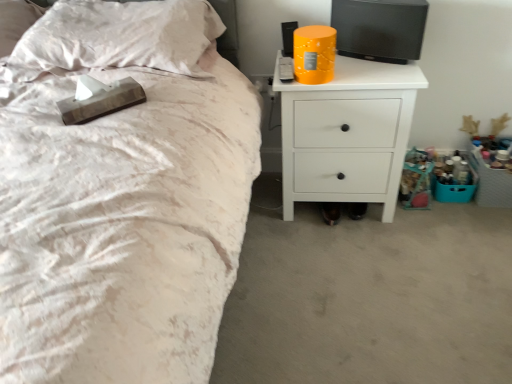
Measure the distance between point (345, 74) and camera.

The depth of point (345, 74) is 1.62 meters.

Find the location of a particular element. The width and height of the screenshot is (512, 384). white matte nightstand at upper right is located at coordinates (347, 134).

Describe the element at coordinates (347, 134) in the screenshot. This screenshot has height=384, width=512. I see `white matte nightstand at upper right` at that location.

Looking at this image, what is the approximate width of white satin pillow at upper left?

17.87 inches.

Locate an element on the screen. Image resolution: width=512 pixels, height=384 pixels. white satin pillow at upper left is located at coordinates (115, 38).

Describe the element at coordinates (115, 38) in the screenshot. I see `white satin pillow at upper left` at that location.

I want to click on white matte nightstand at upper right, so click(347, 134).

Does white satin pillow at upper left appear on the right side of white matte nightstand at upper right?

In fact, white satin pillow at upper left is to the left of white matte nightstand at upper right.

Is the position of white satin pillow at upper left less distant than that of white matte nightstand at upper right?

Yes, it is in front of white matte nightstand at upper right.

Considering the points (153, 43) and (421, 79), which point is behind, point (153, 43) or point (421, 79)?

The point (421, 79) is farther.

From the picture: From the image's perspective, which one is positioned higher, white satin pillow at upper left or white matte nightstand at upper right?

white satin pillow at upper left, from the image's perspective.

From a real-world perspective, who is located higher, white satin pillow at upper left or white matte nightstand at upper right?

In real-world perspective, white satin pillow at upper left is above.

From the picture: Looking at their sizes, would you say white satin pillow at upper left is wider or thinner than white matte nightstand at upper right?

Clearly, white satin pillow at upper left has more width compared to white matte nightstand at upper right.

Is white satin pillow at upper left shorter than white matte nightstand at upper right?

Yes.

Who is bigger, white satin pillow at upper left or white matte nightstand at upper right?

Result: white matte nightstand at upper right is bigger.

Is white matte nightstand at upper right surrounded by white satin pillow at upper left?

That's incorrect, white matte nightstand at upper right is not inside white satin pillow at upper left.

Looking at this image, is white satin pillow at upper left far from white matte nightstand at upper right?

No, white satin pillow at upper left is not far away from white matte nightstand at upper right.

Is white satin pillow at upper left turned away from white matte nightstand at upper right?

No, white satin pillow at upper left's orientation is not away from white matte nightstand at upper right.

At what (x,y) coordinates should I click in order to perform the action: click on nightstand that appears behind the white satin pillow at upper left. Please return your answer as a coordinate pair (x, y). Looking at the image, I should click on (347, 134).

Which is more to the left, white matte nightstand at upper right or white satin pillow at upper left?

white satin pillow at upper left.

Which is behind, white matte nightstand at upper right or white satin pillow at upper left?

white matte nightstand at upper right is more distant.

Does point (353, 185) come closer to viewer compared to point (207, 18)?

No.

Looking at this image, from the image's perspective, which is below, white matte nightstand at upper right or white satin pillow at upper left?

From the image's view, white matte nightstand at upper right is below.

From a real-world perspective, is white matte nightstand at upper right above or below white satin pillow at upper left?

Clearly, from a real-world perspective, white matte nightstand at upper right is below white satin pillow at upper left.

Which object is wider, white matte nightstand at upper right or white satin pillow at upper left?

With larger width is white satin pillow at upper left.

Considering the sizes of objects white matte nightstand at upper right and white satin pillow at upper left in the image provided, who is shorter, white matte nightstand at upper right or white satin pillow at upper left?

With less height is white satin pillow at upper left.

Considering the relative sizes of white matte nightstand at upper right and white satin pillow at upper left in the image provided, is white matte nightstand at upper right bigger than white satin pillow at upper left?

Indeed, white matte nightstand at upper right has a larger size compared to white satin pillow at upper left.

Is white matte nightstand at upper right spatially inside white satin pillow at upper left, or outside of it?

white matte nightstand at upper right is not inside white satin pillow at upper left, it's outside.

Based on the photo, is there a large distance between white matte nightstand at upper right and white satin pillow at upper left?

white matte nightstand at upper right is actually quite close to white satin pillow at upper left.

Is white matte nightstand at upper right oriented towards white satin pillow at upper left?

No.

Find the location of `pillow above the white matte nightstand at upper right (from a real-world perspective)`. pillow above the white matte nightstand at upper right (from a real-world perspective) is located at coordinates (115, 38).

I want to click on nightstand below the white satin pillow at upper left (from the image's perspective), so click(x=347, y=134).

Where is `pillow on the left side of white matte nightstand at upper right`? Image resolution: width=512 pixels, height=384 pixels. pillow on the left side of white matte nightstand at upper right is located at coordinates (115, 38).